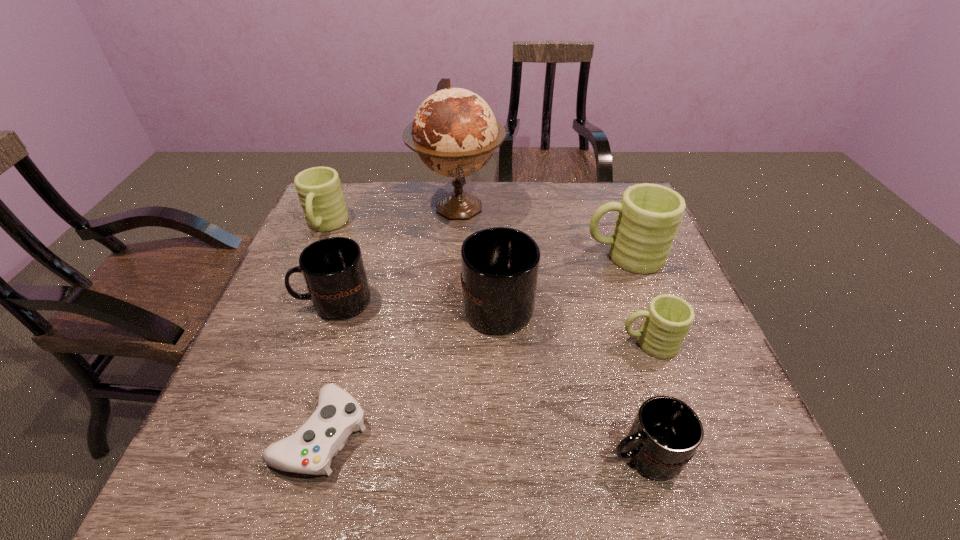
You are a GUI agent. You are given a task and a screenshot of the screen. Output one action in this format:
    pyautogui.click(x=<x>, y=<y>)
    Task: Click on the vacant space located 0.280m on the side of the nearest green mug with the handle
    The image size is (960, 540).
    Given the screenshot: What is the action you would take?
    pyautogui.click(x=494, y=343)

This screenshot has height=540, width=960. I want to click on free region located on the side of the nearest green mug with the handle, so click(x=574, y=343).

Identify the location of free space located with the handle on the side of the nearest mug. (498, 454).

Identify the location of free point located 0.190m with the handle on the side of the nearest mug. The height and width of the screenshot is (540, 960). pyautogui.click(x=504, y=454).

What are the coordinates of `free spot located 0.170m with the handle on the side of the nearest mug` in the screenshot? It's located at (515, 454).

Where is `free region located 0.270m on the right of the white control`? free region located 0.270m on the right of the white control is located at coordinates (509, 434).

Where is `globe located in the far edge section of the desktop`? Image resolution: width=960 pixels, height=540 pixels. globe located in the far edge section of the desktop is located at coordinates (454, 132).

This screenshot has width=960, height=540. Identify the location of mug situated at the far edge. (320, 194).

Find the location of a particular element. mug that is at the near edge is located at coordinates (666, 432).

This screenshot has height=540, width=960. Find the location of `control that is at the near edge`. control that is at the near edge is located at coordinates (310, 450).